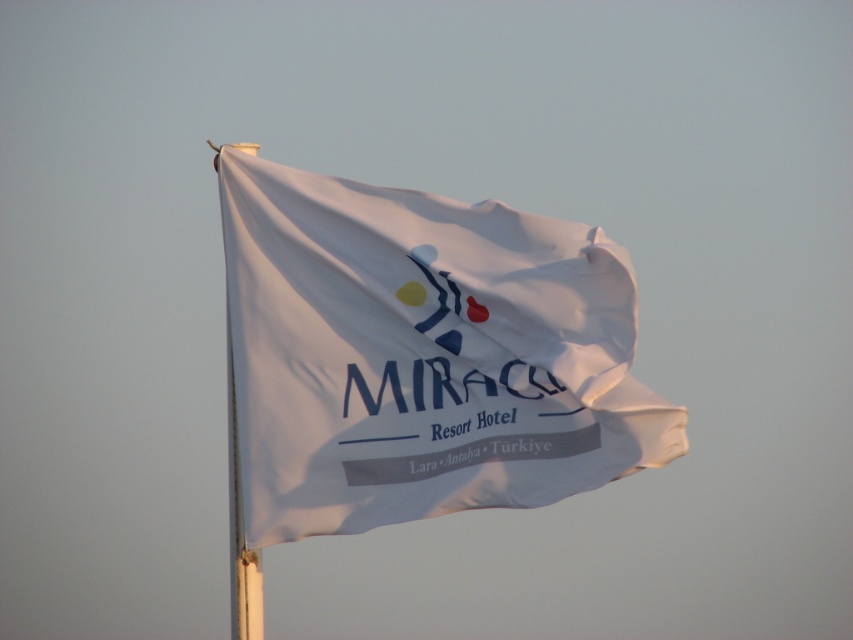
Question: Is white fabric flag at center closer to the viewer compared to white fabric flagpole at left?

Choices:
 (A) yes
 (B) no

Answer: (A)

Question: Among these points, which one is farthest from the camera?

Choices:
 (A) (268, 298)
 (B) (229, 515)

Answer: (B)

Question: Is white fabric flag at center to the right of white fabric flagpole at left from the viewer's perspective?

Choices:
 (A) no
 (B) yes

Answer: (B)

Question: Can you confirm if white fabric flag at center is smaller than white fabric flagpole at left?

Choices:
 (A) no
 (B) yes

Answer: (B)

Question: Which point is farther to the camera?

Choices:
 (A) white fabric flagpole at left
 (B) white fabric flag at center

Answer: (A)